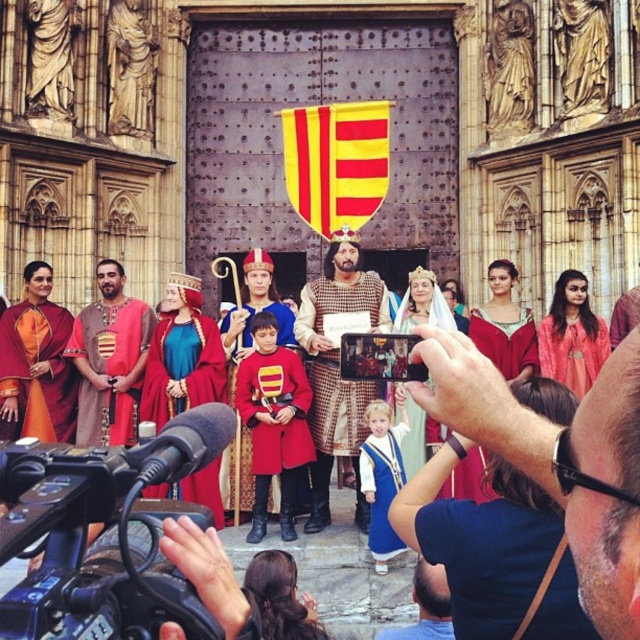
Question: Which of these objects is positioned farthest from the matte pink dress at center?

Choices:
 (A) blue velvet robe at center
 (B) black plastic video camera at lower left

Answer: (B)

Question: Is matte gold crown at center wider than matte red tunic at center?

Choices:
 (A) no
 (B) yes

Answer: (B)

Question: Is matte gold crown at center in front of matte red tunic at center?

Choices:
 (A) no
 (B) yes

Answer: (B)

Question: Among these points, which one is nearest to the camera?

Choices:
 (A) (368, 513)
 (B) (522, 465)
 (C) (20, 326)
 (D) (576, 394)

Answer: (B)

Question: Can you confirm if checkered fabric tunic at center is positioned to the right of matte pink dress at center?

Choices:
 (A) no
 (B) yes

Answer: (A)

Question: Which object appears farthest from the camera in this image?

Choices:
 (A) matte red tunic at center
 (B) matte gold crown at center
 (C) matte pink dress at center

Answer: (C)